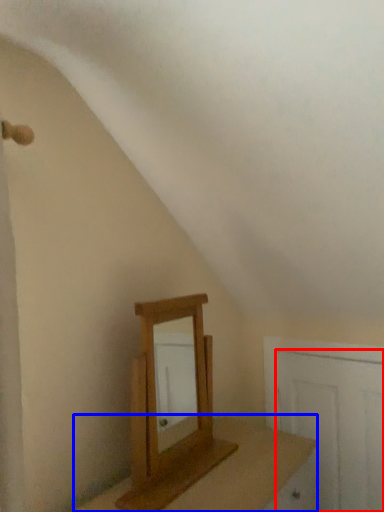
Question: Which of the following is the closest to the observer, door (highlighted by a red box) or table (highlighted by a blue box)?

Choices:
 (A) door
 (B) table

Answer: (B)